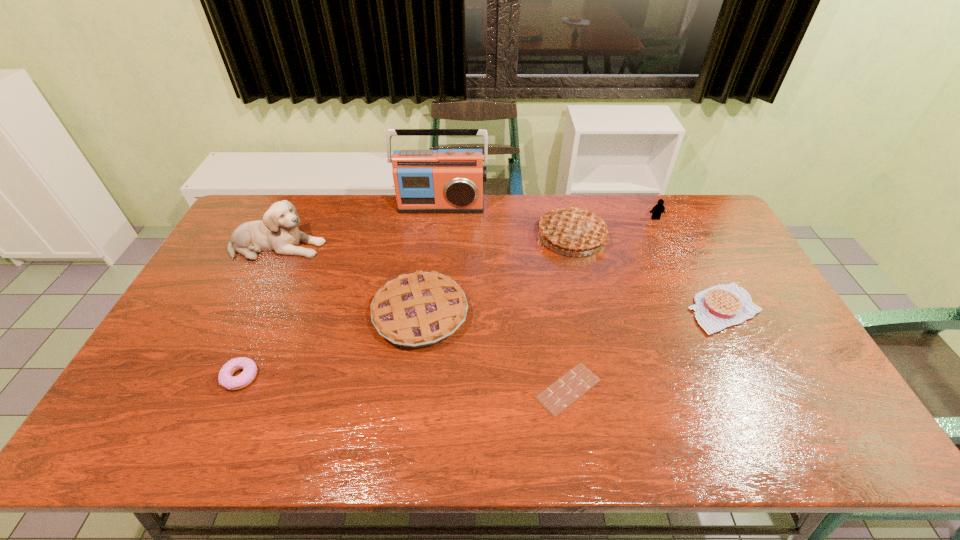
Identify the location of free space that satisfies the following two spatial constraints: 1. on the back side of the second shortest pie; 2. on the right side of the doughnut. The width and height of the screenshot is (960, 540). (268, 315).

You are a GUI agent. You are given a task and a screenshot of the screen. Output one action in this format:
    pyautogui.click(x=<x>, y=<y>)
    Task: Click on the free spot that satisfies the following two spatial constraints: 1. on the front-facing side of the radio receiver; 2. on the front-facing side of the puppy
    
    Given the screenshot: What is the action you would take?
    pyautogui.click(x=437, y=246)